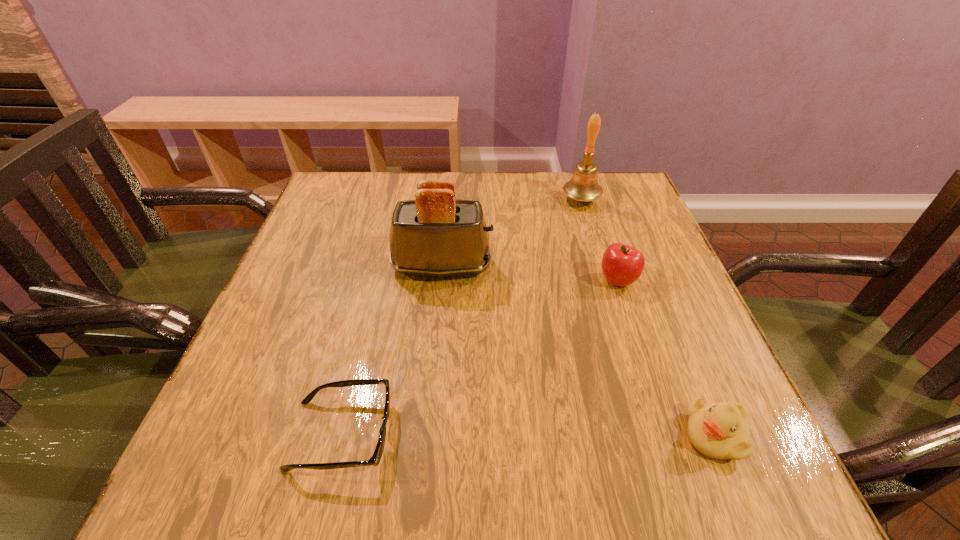
What are the coordinates of `vacant space situated 0.310m on the beak of the duckling` in the screenshot? It's located at (489, 435).

Where is `vacant space positioned on the lenses of the spectacles`? vacant space positioned on the lenses of the spectacles is located at coordinates (448, 434).

In order to click on object present at the far edge in this screenshot , I will do `click(583, 186)`.

I want to click on duckling that is positioned at the near edge, so click(721, 431).

You are a GUI agent. You are given a task and a screenshot of the screen. Output one action in this format:
    pyautogui.click(x=<x>, y=<y>)
    Task: Click on the spectacles that is at the near edge
    
    Given the screenshot: What is the action you would take?
    pyautogui.click(x=376, y=457)

Locate an element on the screen. object at the left edge is located at coordinates (376, 457).

Image resolution: width=960 pixels, height=540 pixels. I want to click on bell that is at the right edge, so click(x=583, y=186).

Locate an element on the screen. This screenshot has width=960, height=540. apple at the right edge is located at coordinates (622, 265).

Where is `duckling that is at the right edge`? The height and width of the screenshot is (540, 960). duckling that is at the right edge is located at coordinates (721, 431).

Identify the location of object positioned at the near left corner. This screenshot has width=960, height=540. (376, 457).